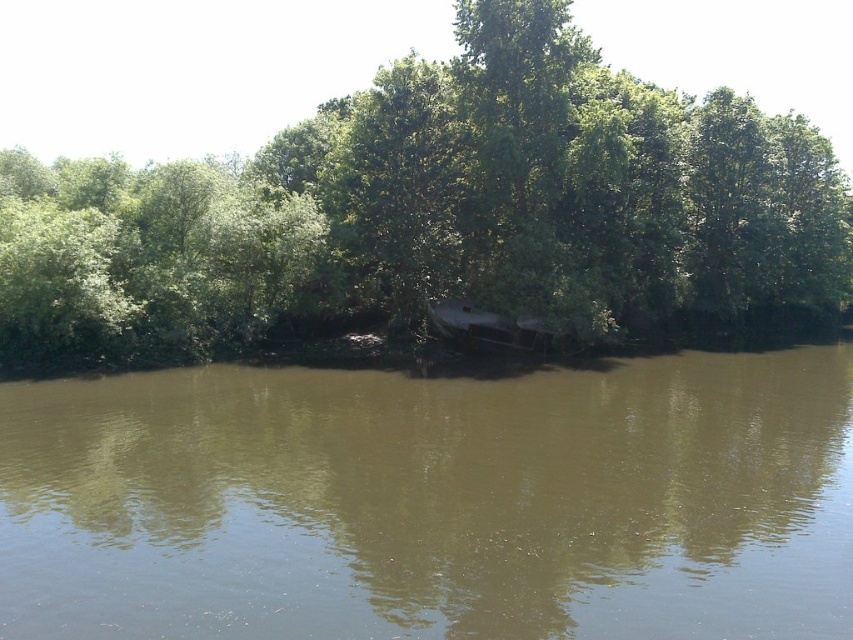
Question: Which object is positioned closest to the brown murky water at center?

Choices:
 (A) green leafy tree at center
 (B) dark brown wood boat at center

Answer: (B)

Question: Is green leafy tree at center positioned before dark brown wood boat at center?

Choices:
 (A) yes
 (B) no

Answer: (A)

Question: Considering the real-world distances, which object is closest to the dark brown wood boat at center?

Choices:
 (A) green leafy tree at center
 (B) brown murky water at center

Answer: (B)

Question: Considering the relative positions of brown murky water at center and green leafy tree at center in the image provided, where is brown murky water at center located with respect to green leafy tree at center?

Choices:
 (A) right
 (B) left

Answer: (B)

Question: Is brown murky water at center above dark brown wood boat at center?

Choices:
 (A) yes
 (B) no

Answer: (B)

Question: Which point is closer to the camera?

Choices:
 (A) (140, 348)
 (B) (456, 323)
 (C) (722, 486)

Answer: (C)